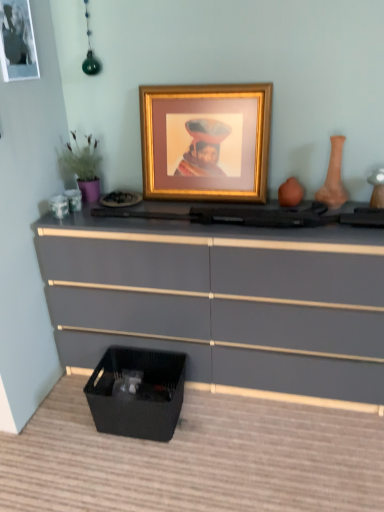
You are a GUI agent. You are given a task and a screenshot of the screen. Output one action in this format:
    pyautogui.click(x=<x>, y=<y>)
    Task: Click on the free spot in front of black woven basket at lower left
    This screenshot has height=512, width=384.
    Given the screenshot: What is the action you would take?
    pyautogui.click(x=132, y=471)